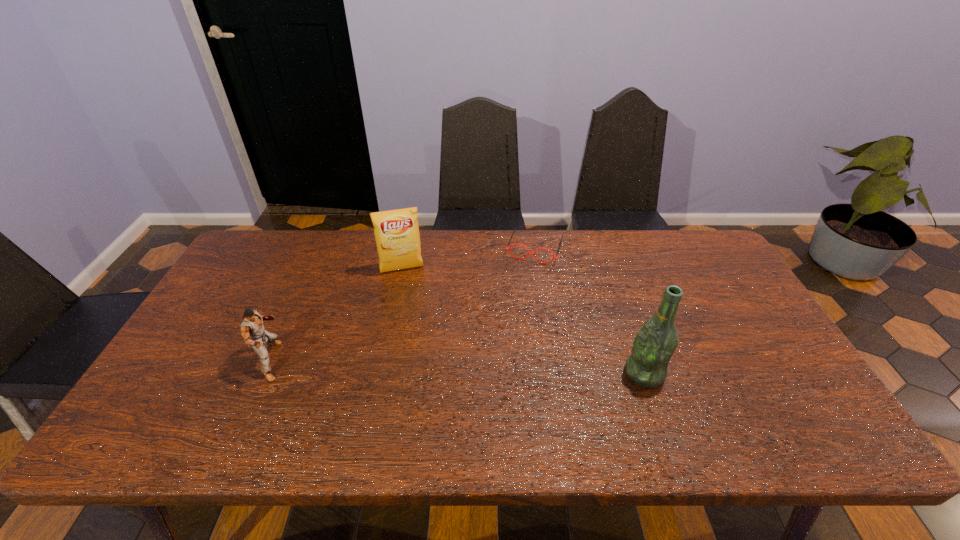
You are a GUI agent. You are given a task and a screenshot of the screen. Output one action in this format:
    pyautogui.click(x=<x>, y=<y>)
    Task: Click on the puncher that is at the near edge
    The width and height of the screenshot is (960, 540).
    Given the screenshot: What is the action you would take?
    pyautogui.click(x=252, y=330)

The height and width of the screenshot is (540, 960). I want to click on beer bottle present at the near edge, so click(654, 345).

The width and height of the screenshot is (960, 540). Find the location of `free point at the far edge`. free point at the far edge is located at coordinates (457, 251).

At what (x,y) coordinates should I click in order to perform the action: click on free location at the left edge of the desktop. Please return your answer as a coordinate pair (x, y). This screenshot has width=960, height=540. Looking at the image, I should click on (202, 329).

The image size is (960, 540). I want to click on free region at the far right corner of the desktop, so click(721, 273).

Where is `free spot between the tallest object and the second tallest object`? This screenshot has width=960, height=540. free spot between the tallest object and the second tallest object is located at coordinates (523, 321).

Find the location of a particular element. The image size is (960, 540). unoccupied position between the third shortest object and the spectacles is located at coordinates (468, 259).

Where is `vacant area between the rightmost object and the shortest object`? The height and width of the screenshot is (540, 960). vacant area between the rightmost object and the shortest object is located at coordinates tap(589, 310).

Locate an element on the screen. The image size is (960, 540). vacant space in between the third object from right to left and the tallest object is located at coordinates (523, 321).

Where is `vacant region between the crisp (potato chip) and the rightmost object`? This screenshot has height=540, width=960. vacant region between the crisp (potato chip) and the rightmost object is located at coordinates (523, 321).